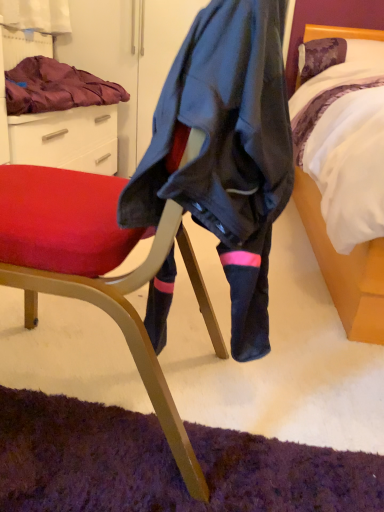
Question: Is matte black chair at center positioned far away from white satin bed at right?

Choices:
 (A) no
 (B) yes

Answer: (A)

Question: From the image's perspective, is matte black chair at center on white satin bed at right?

Choices:
 (A) yes
 (B) no

Answer: (B)

Question: Is white satin bed at right completely or partially inside matte black chair at center?

Choices:
 (A) yes
 (B) no

Answer: (B)

Question: Is matte black chair at center closer to the viewer compared to white satin bed at right?

Choices:
 (A) yes
 (B) no

Answer: (A)

Question: Is matte black chair at center aimed at white satin bed at right?

Choices:
 (A) no
 (B) yes

Answer: (A)

Question: In the image, is white satin bed at right on the left side or the right side of matte black chair at center?

Choices:
 (A) right
 (B) left

Answer: (A)

Question: In the image, is white satin bed at right positioned in front of or behind matte black chair at center?

Choices:
 (A) front
 (B) behind

Answer: (B)

Question: Is white satin bed at right bigger or smaller than matte black chair at center?

Choices:
 (A) big
 (B) small

Answer: (A)

Question: From their relative heights in the image, would you say white satin bed at right is taller or shorter than matte black chair at center?

Choices:
 (A) tall
 (B) short

Answer: (A)

Question: From a real-world perspective, is velvet purple blanket at upper left physically located above or below matte black chair at center?

Choices:
 (A) below
 (B) above

Answer: (B)

Question: In terms of width, does velvet purple blanket at upper left look wider or thinner when compared to matte black chair at center?

Choices:
 (A) wide
 (B) thin

Answer: (B)

Question: Is velvet purple blanket at upper left bigger or smaller than matte black chair at center?

Choices:
 (A) small
 (B) big

Answer: (A)

Question: In terms of height, does velvet purple blanket at upper left look taller or shorter compared to matte black chair at center?

Choices:
 (A) short
 (B) tall

Answer: (A)

Question: From the image's perspective, is velvet purple blanket at upper left positioned above or below white satin bed at right?

Choices:
 (A) above
 (B) below

Answer: (A)

Question: From a real-world perspective, is velvet purple blanket at upper left above or below white satin bed at right?

Choices:
 (A) above
 (B) below

Answer: (A)